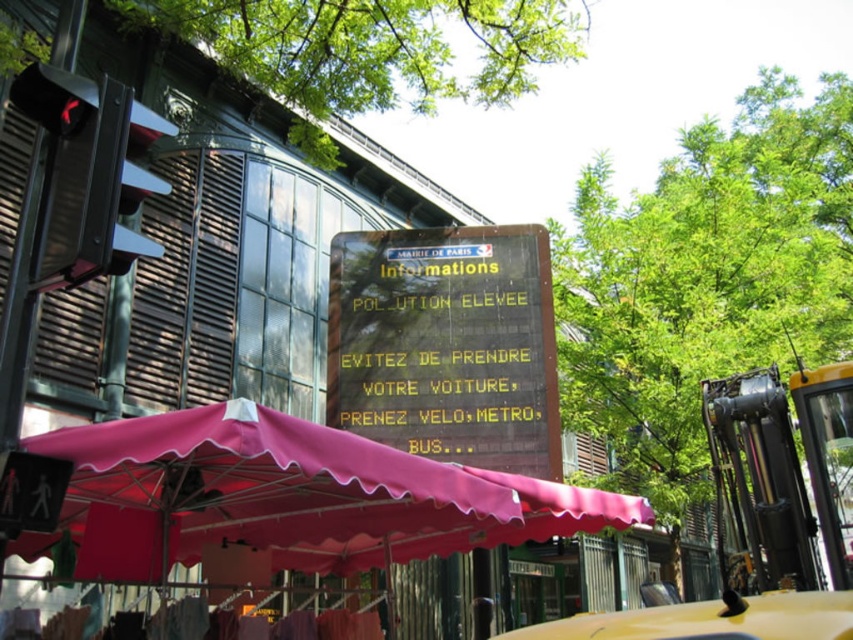
Who is higher up, wooden signboard at center or yellow rubber taxi at lower right?

Positioned higher is wooden signboard at center.

Does wooden signboard at center appear under yellow rubber taxi at lower right?

No, wooden signboard at center is not below yellow rubber taxi at lower right.

This screenshot has height=640, width=853. Describe the element at coordinates (445, 344) in the screenshot. I see `wooden signboard at center` at that location.

Locate an element on the screen. wooden signboard at center is located at coordinates (445, 344).